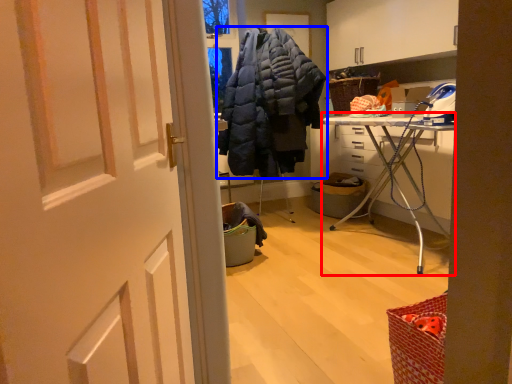
Question: Which object appears farthest to the camera in this image, furniture (highlighted by a red box) or jacket (highlighted by a blue box)?

Choices:
 (A) furniture
 (B) jacket

Answer: (B)